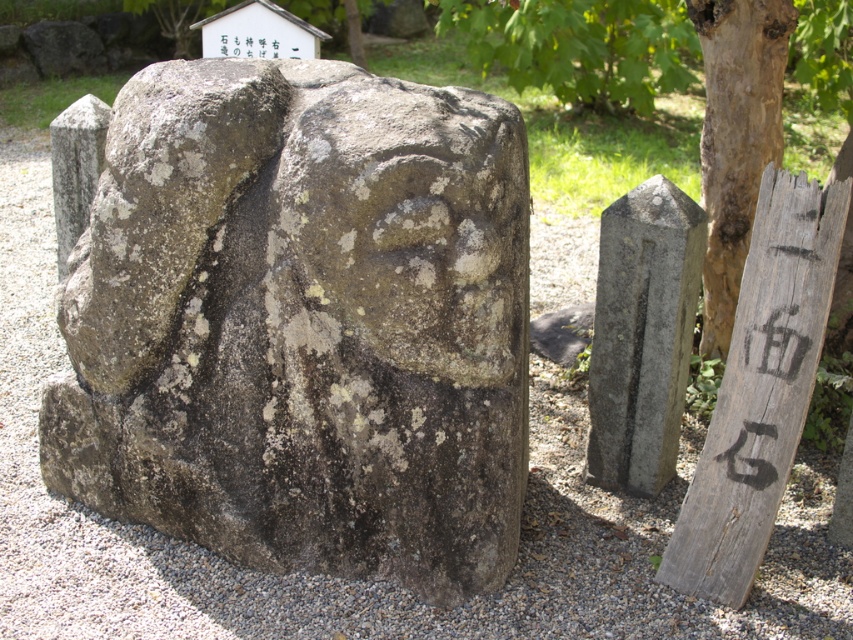
Who is lower down, gray stone marker at right or black painted wood at right?

Positioned lower is black painted wood at right.

Which of these two, gray stone marker at right or black painted wood at right, stands taller?

With more height is black painted wood at right.

Locate an element on the screen. The width and height of the screenshot is (853, 640). gray stone marker at right is located at coordinates (642, 336).

Does rusty stone statue at center have a larger size compared to rough stone face at center?

Indeed, rusty stone statue at center has a larger size compared to rough stone face at center.

I want to click on rusty stone statue at center, so click(x=303, y=323).

Is point (209, 541) behind point (514, 134)?

Yes, it is behind point (514, 134).

Identify the location of rusty stone statue at center. (303, 323).

Is rough stone face at center further to the viewer compared to gray stone marker at right?

No, rough stone face at center is in front of gray stone marker at right.

Who is positioned more to the right, rough stone face at center or gray stone marker at right?

Positioned to the right is gray stone marker at right.

Which is behind, point (405, 86) or point (660, 432)?

Positioned behind is point (660, 432).

The width and height of the screenshot is (853, 640). I want to click on rough stone face at center, so click(x=413, y=225).